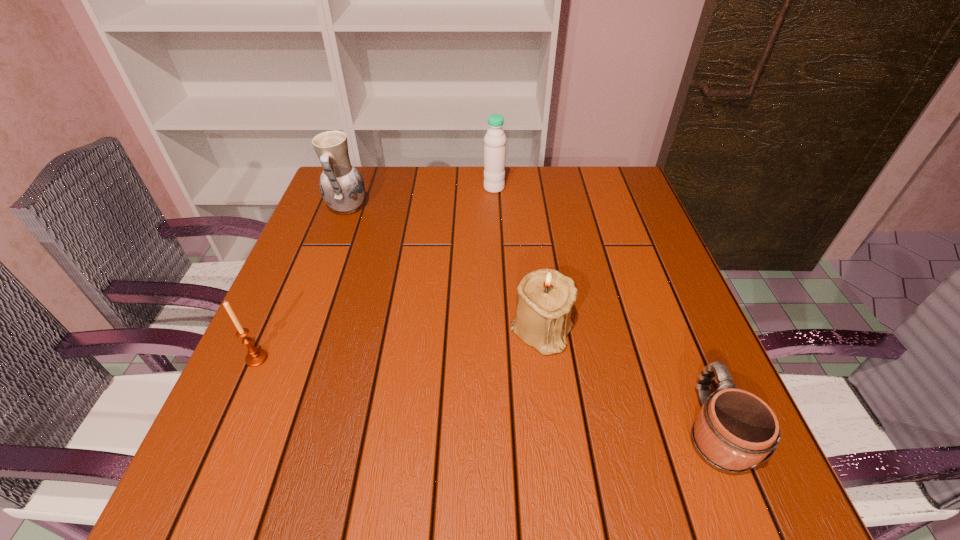
The width and height of the screenshot is (960, 540). In order to click on object at the near right corner in this screenshot , I will do `click(734, 430)`.

At what (x,y) coordinates should I click in order to perform the action: click on vacant area at the far edge of the desktop. Please return your answer as a coordinate pair (x, y). The image size is (960, 540). Looking at the image, I should click on (453, 194).

Where is `free space at the near edge of the desktop`? This screenshot has width=960, height=540. free space at the near edge of the desktop is located at coordinates (657, 471).

The image size is (960, 540). I want to click on free location at the left edge, so click(x=308, y=332).

In the image, there is a desktop. At what (x,y) coordinates should I click in order to perform the action: click on vacant space at the right edge. Please return your answer as a coordinate pair (x, y). The image size is (960, 540). Looking at the image, I should click on (625, 242).

Where is `blank area at the far left corner`? Image resolution: width=960 pixels, height=540 pixels. blank area at the far left corner is located at coordinates pos(365,207).

Locate an element on the screen. vacant space at the far right corner is located at coordinates (582, 170).

Locate an element on the screen. vacant region between the water bottle and the left candle_holder is located at coordinates (375, 273).

The width and height of the screenshot is (960, 540). Identify the location of vacant area between the right candle_holder and the water bottle. (518, 259).

Find the location of a particular element. The height and width of the screenshot is (540, 960). blank region between the pottery and the right candle_holder is located at coordinates (444, 269).